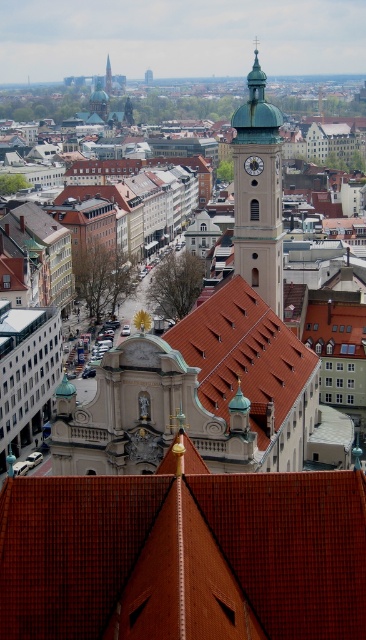
You are an architect analyzing the cityscape. You notice the brown tile roof at center and the green glass spire at upper center. Which of these two structures appears bigger in the image?

The brown tile roof at center is larger in size than the green glass spire at upper center, so it appears bigger in the image.

You are an architect analyzing the cityscape. Based on the scene, which object is shorter between the brown tiled roof at center and the light brown stone bell tower at center?

The brown tiled roof at center is not as tall as the light brown stone bell tower at center, so the brown tiled roof at center is shorter.